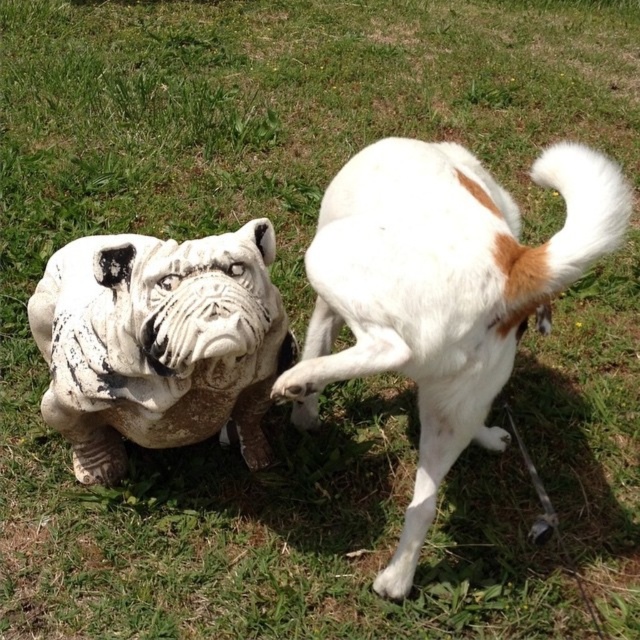
You are a visitor at a park and see the white fur dog at right and the white stone statue at center. Which one is bigger in size?

The white fur dog at right is larger in size compared to the white stone statue at center.